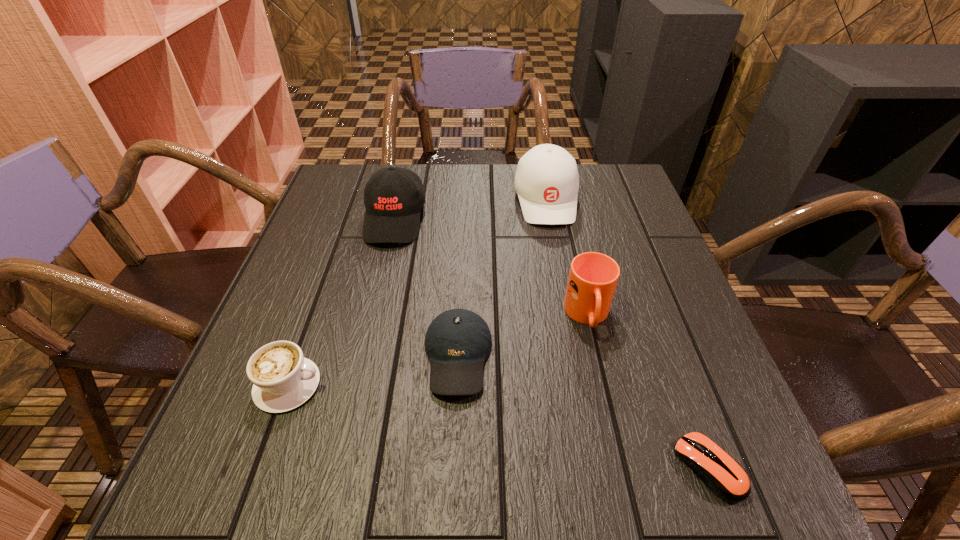
At what (x,y) coordinates should I click in order to perform the action: click on free space that satisfies the following two spatial constraints: 1. on the handle side of the mug; 2. on the right side of the computer mouse. Please return your answer as a coordinate pair (x, y). The height and width of the screenshot is (540, 960). Looking at the image, I should click on (623, 468).

At what (x,y) coordinates should I click in order to perform the action: click on free space that satisfies the following two spatial constraints: 1. to the right of the cappuccino's handle; 2. on the left side of the rightmost object. Please return your answer as a coordinate pair (x, y). The image size is (960, 540). Looking at the image, I should click on (259, 468).